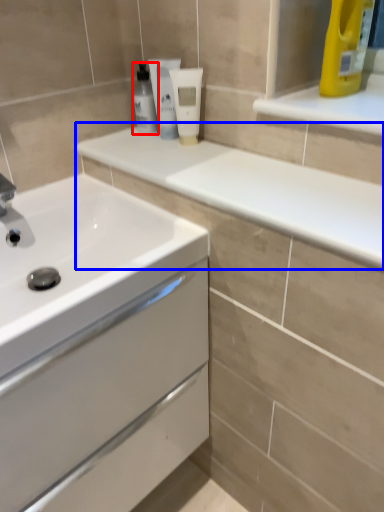
Question: Among these objects, which one is nearest to the camera, mouthwash (highlighted by a red box) or counter top (highlighted by a blue box)?

Choices:
 (A) mouthwash
 (B) counter top

Answer: (B)